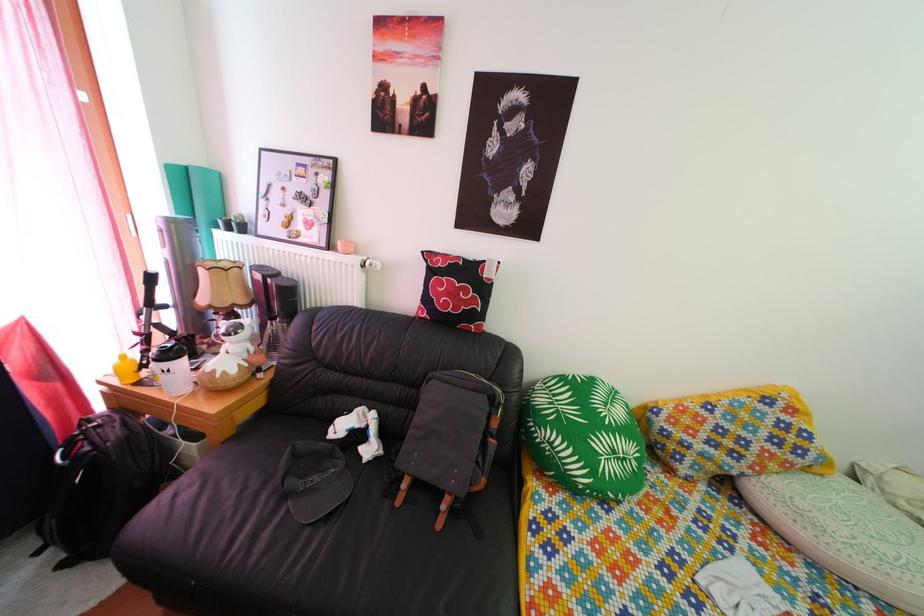
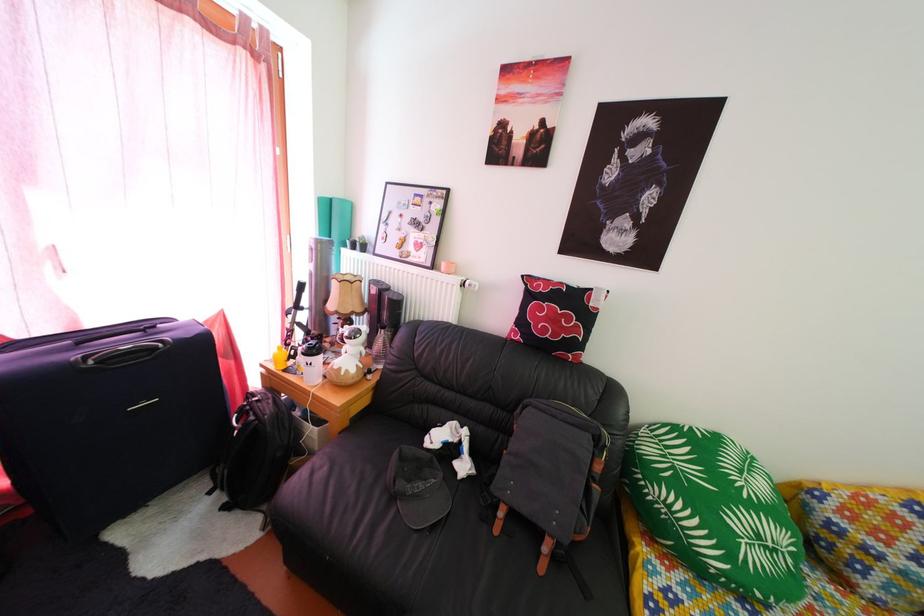
The point at [634,468] is marked in the first image. Where is the corresponding point in the second image?

(784, 560)